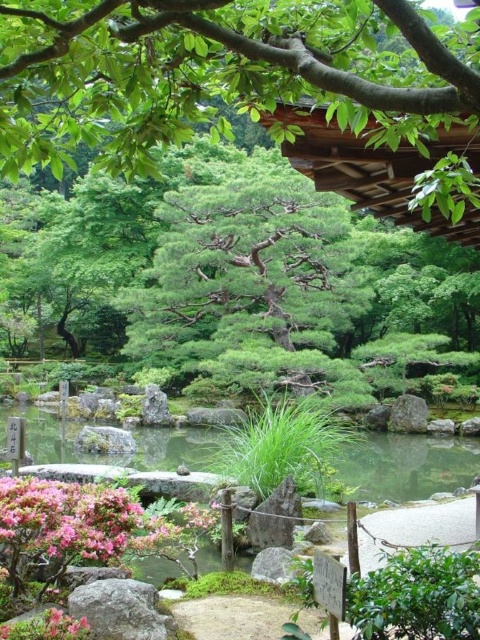
You are a gardener who needs to place a 6 meter long wooden bridge between the green stone pond at center and the pink matte flowers at lower left. Will the bridge fit perfectly between them?

The distance between the green stone pond at center and the pink matte flowers at lower left is 6.16 meters. Since the bridge is 6 meters long, it will fit with a small gap of 0.16 meters remaining between them.

You are a visitor in the Japanese garden and want to take a photo of the pink matte flowers at lower left and the green stone pond at center. Which object should you position to your left side when framing the shot?

To frame the photo with the pink matte flowers at lower left on your left side and the green stone pond at center on your right, position the pink matte flowers at lower left to your left since it is to the left of the green stone pond at center.

You are a visitor in the Japanese garden and want to take a photo of the green stone pond at center and the pink matte flowers at lower left. From where should you stand to ensure both are visible in the frame?

To capture both the green stone pond at center and the pink matte flowers at lower left in your photo, you should position yourself at a viewpoint where the green stone pond at center is below the pink matte flowers at lower left since the green stone pond at center is positioned under the pink matte flowers at lower left.